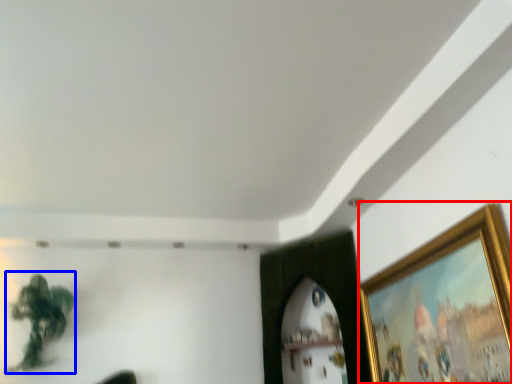
Question: Among these objects, which one is farthest to the camera, picture frame (highlighted by a red box) or plant (highlighted by a blue box)?

Choices:
 (A) picture frame
 (B) plant

Answer: (B)